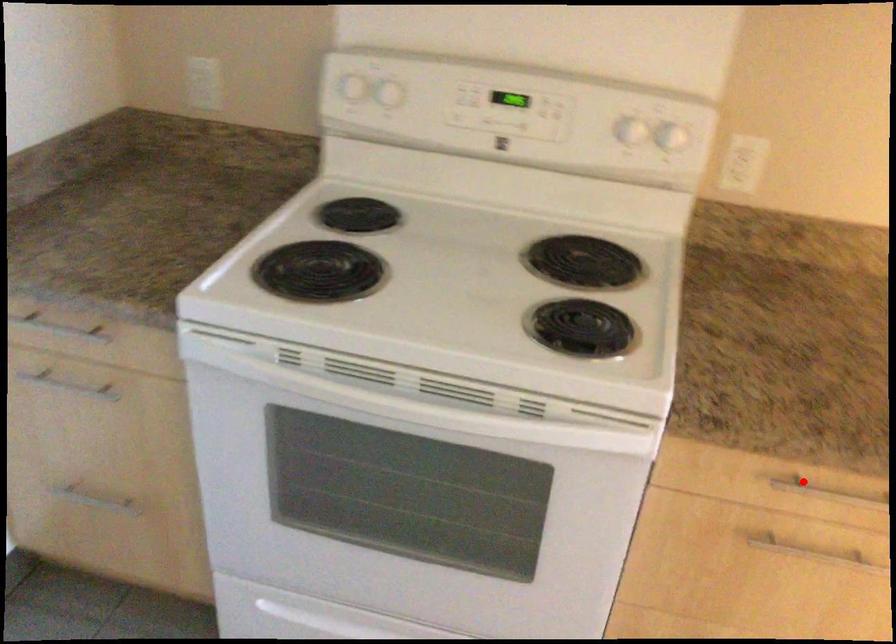
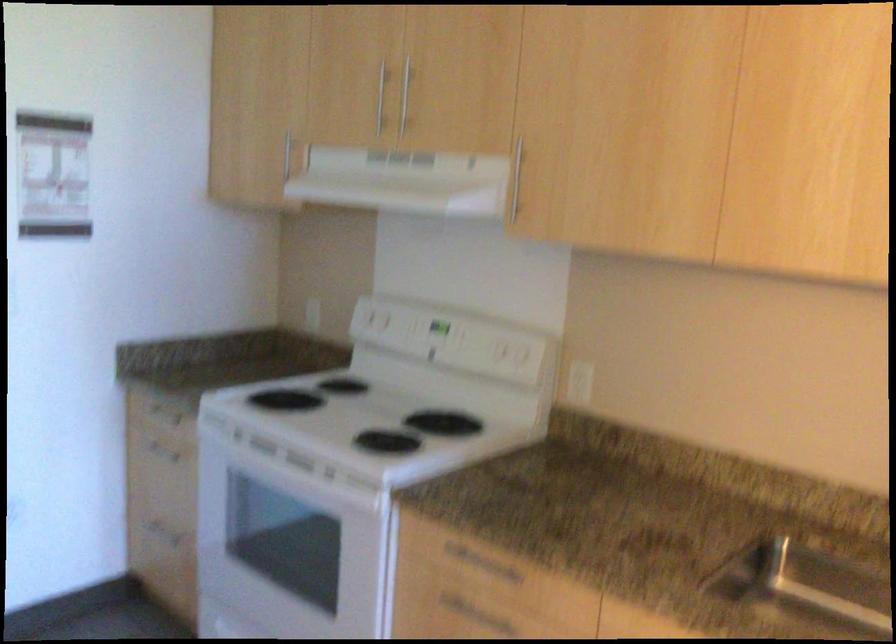
Question: I am providing you with two images of the same scene from different viewpoints. Image1 has a red point marked. In image2, the corresponding 3D location appears at what relative position? Reply with the corresponding letter.

Choices:
 (A) Closer
 (B) Farther

Answer: (B)